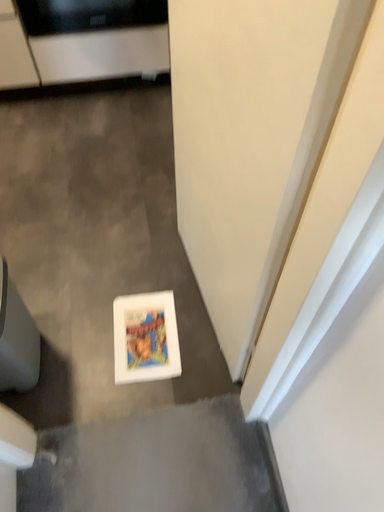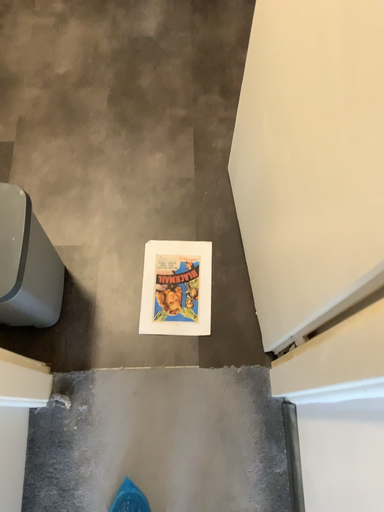
Question: How did the camera likely rotate when shooting the video?

Choices:
 (A) rotated upward
 (B) rotated downward

Answer: (B)